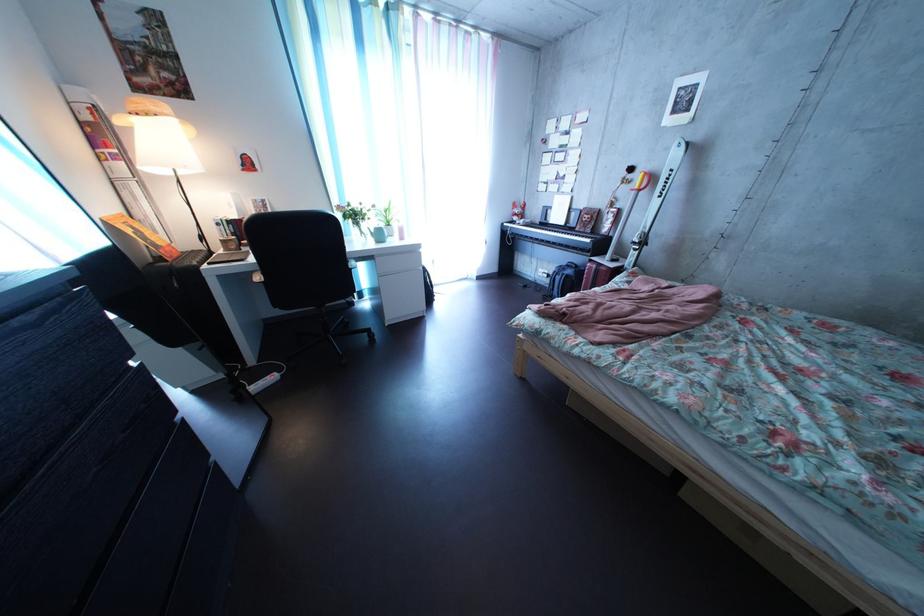
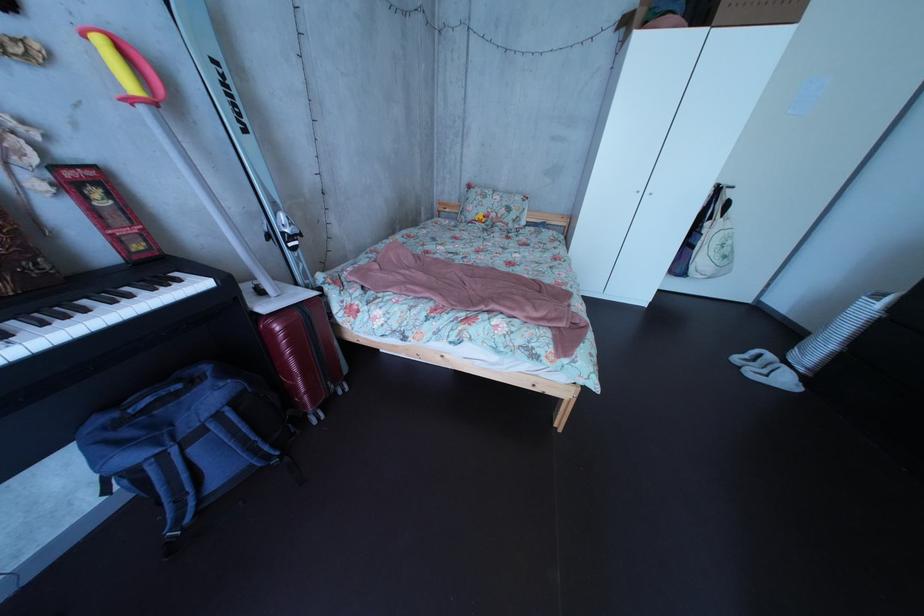
Find the pixel in the second image that matches the point at 610,274 in the first image.

(311, 322)